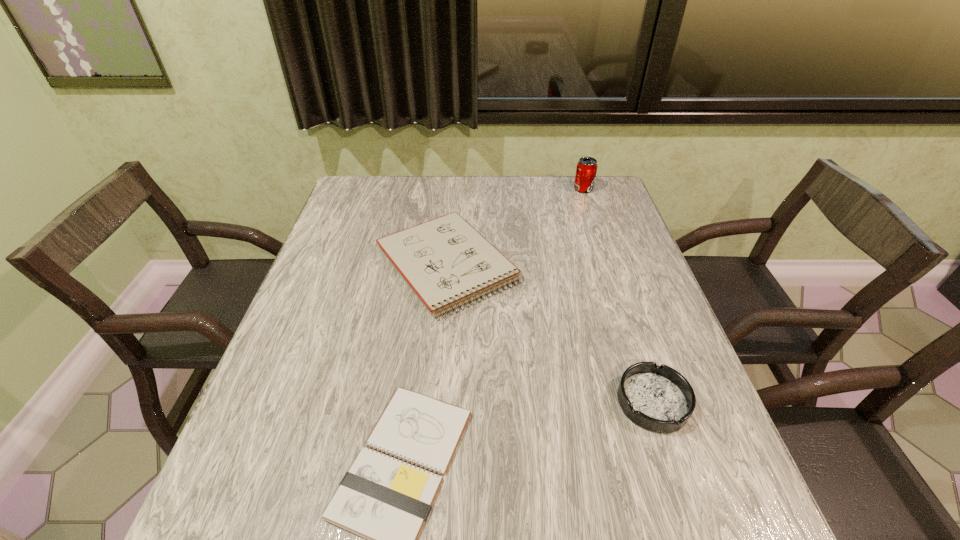
Where is `vacant space in between the soda can and the ashtray`? This screenshot has width=960, height=540. vacant space in between the soda can and the ashtray is located at coordinates (618, 295).

Locate an element on the screen. The image size is (960, 540). vacant area that lies between the tallest object and the farther notepad is located at coordinates (516, 227).

In order to click on free space between the soda can and the ashtray in this screenshot , I will do `click(618, 295)`.

Locate an element on the screen. The width and height of the screenshot is (960, 540). object that is the closest one to the farther notepad is located at coordinates (387, 501).

Locate an element on the screen. The height and width of the screenshot is (540, 960). object that is the second closest one to the nearer notepad is located at coordinates (659, 399).

Find the location of a particular element. The width and height of the screenshot is (960, 540). free space that satisfies the following two spatial constraints: 1. on the back side of the third nearest object; 2. on the right side of the farthest object is located at coordinates (453, 189).

The image size is (960, 540). Identify the location of vacant position in the image that satisfies the following two spatial constraints: 1. on the back side of the ashtray; 2. on the right side of the tallest object. (583, 189).

The width and height of the screenshot is (960, 540). What are the coordinates of `free space that satisfies the following two spatial constraints: 1. on the back side of the ashtray; 2. on the right side of the soda can` in the screenshot? It's located at (583, 189).